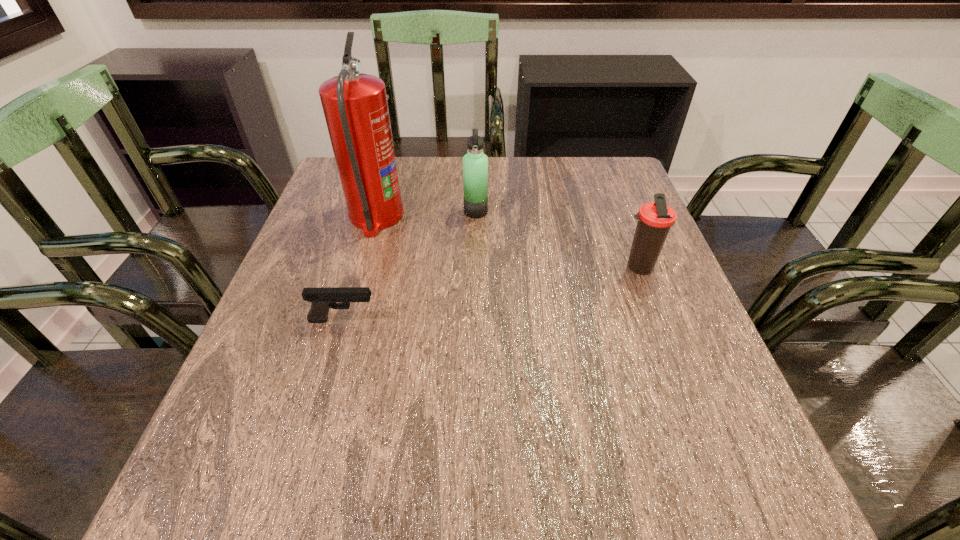
Image resolution: width=960 pixels, height=540 pixels. Find the location of `fire extinguisher`. fire extinguisher is located at coordinates pos(355,106).

What are the coordinates of `the second tallest object` in the screenshot? It's located at (475, 164).

This screenshot has width=960, height=540. Identify the location of the third object from left to right. (475, 164).

In order to click on the right thermos bottle in this screenshot , I will do `click(655, 219)`.

Locate an element on the screen. This screenshot has width=960, height=540. the second nearest object is located at coordinates (655, 219).

Where is `pistol`? This screenshot has height=540, width=960. pistol is located at coordinates (322, 299).

This screenshot has height=540, width=960. In order to click on the shortest object in this screenshot , I will do `click(322, 299)`.

This screenshot has width=960, height=540. Identify the location of free location located 0.260m on the instruction side of the fire extinguisher. (505, 217).

Identify the location of vacant area located 0.170m on the back of the third object from left to right. This screenshot has height=540, width=960. (476, 171).

You are a GUI agent. You are given a task and a screenshot of the screen. Output one action in this format:
    pyautogui.click(x=<x>, y=<y>)
    Task: Click on the vacant space located on the front of the shorter thermos bottle
    This screenshot has height=540, width=960.
    Given the screenshot: What is the action you would take?
    pyautogui.click(x=668, y=347)